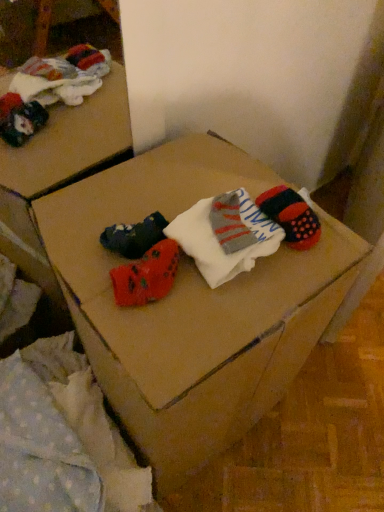
Question: From a real-world perspective, is light blue polka dot fabric at lower left located beneath white soft socks at center?

Choices:
 (A) yes
 (B) no

Answer: (A)

Question: From the image's perspective, is light blue polka dot fabric at lower left on white soft socks at center?

Choices:
 (A) yes
 (B) no

Answer: (B)

Question: Can you confirm if light blue polka dot fabric at lower left is smaller than white soft socks at center?

Choices:
 (A) no
 (B) yes

Answer: (A)

Question: Is light blue polka dot fabric at lower left turned away from white soft socks at center?

Choices:
 (A) no
 (B) yes

Answer: (A)

Question: From the image's perspective, would you say light blue polka dot fabric at lower left is shown under white soft socks at center?

Choices:
 (A) no
 (B) yes

Answer: (B)

Question: Considering the relative sizes of light blue polka dot fabric at lower left and white soft socks at center in the image provided, is light blue polka dot fabric at lower left wider than white soft socks at center?

Choices:
 (A) yes
 (B) no

Answer: (A)

Question: Is white soft socks at center smaller than light blue polka dot fabric at lower left?

Choices:
 (A) no
 (B) yes

Answer: (B)

Question: Does white soft socks at center have a lesser width compared to light blue polka dot fabric at lower left?

Choices:
 (A) yes
 (B) no

Answer: (A)

Question: Can we say white soft socks at center lies outside light blue polka dot fabric at lower left?

Choices:
 (A) no
 (B) yes

Answer: (B)

Question: Considering the relative sizes of white soft socks at center and light blue polka dot fabric at lower left in the image provided, is white soft socks at center shorter than light blue polka dot fabric at lower left?

Choices:
 (A) no
 (B) yes

Answer: (B)

Question: From the image's perspective, is white soft socks at center over light blue polka dot fabric at lower left?

Choices:
 (A) no
 (B) yes

Answer: (B)

Question: Considering the relative positions of white soft socks at center and light blue polka dot fabric at lower left in the image provided, is white soft socks at center in front of light blue polka dot fabric at lower left?

Choices:
 (A) no
 (B) yes

Answer: (A)

Question: From the image's perspective, is light blue polka dot fabric at lower left over cardboard box at center?

Choices:
 (A) yes
 (B) no

Answer: (B)